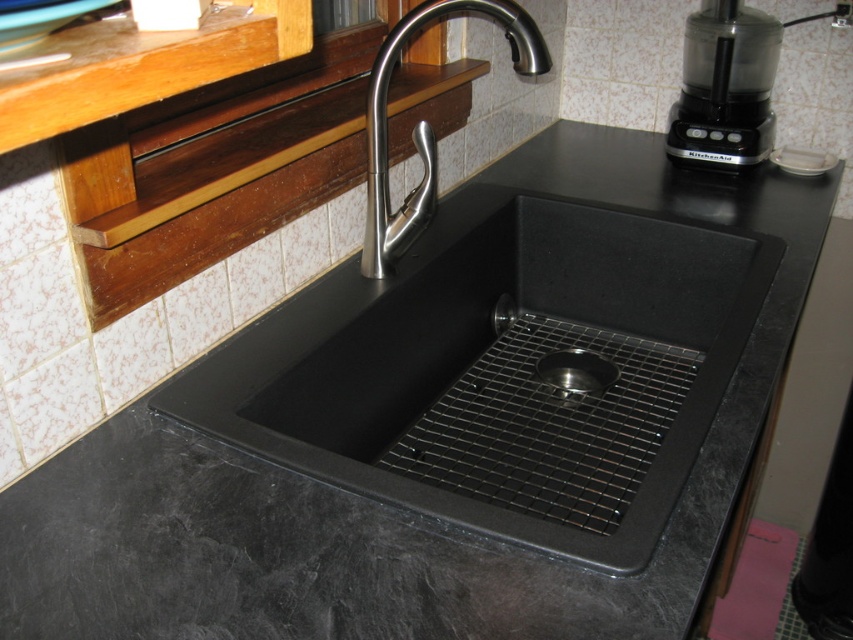
Question: Which object is closer to the camera taking this photo?

Choices:
 (A) black plastic food processor at upper right
 (B) satin nickel faucet at center
 (C) metallic silver drain at center

Answer: (B)

Question: Which point is farther to the camera?

Choices:
 (A) (535, 369)
 (B) (683, 76)
 (C) (405, 35)

Answer: (B)

Question: Which is farther from the black plastic food processor at upper right?

Choices:
 (A) satin nickel faucet at center
 (B) metallic silver drain at center

Answer: (A)

Question: Does satin nickel faucet at center appear over metallic silver drain at center?

Choices:
 (A) no
 (B) yes

Answer: (B)

Question: Considering the relative positions of black plastic food processor at upper right and metallic silver drain at center in the image provided, where is black plastic food processor at upper right located with respect to metallic silver drain at center?

Choices:
 (A) right
 (B) left

Answer: (A)

Question: Does black plastic food processor at upper right appear over satin nickel faucet at center?

Choices:
 (A) no
 (B) yes

Answer: (B)